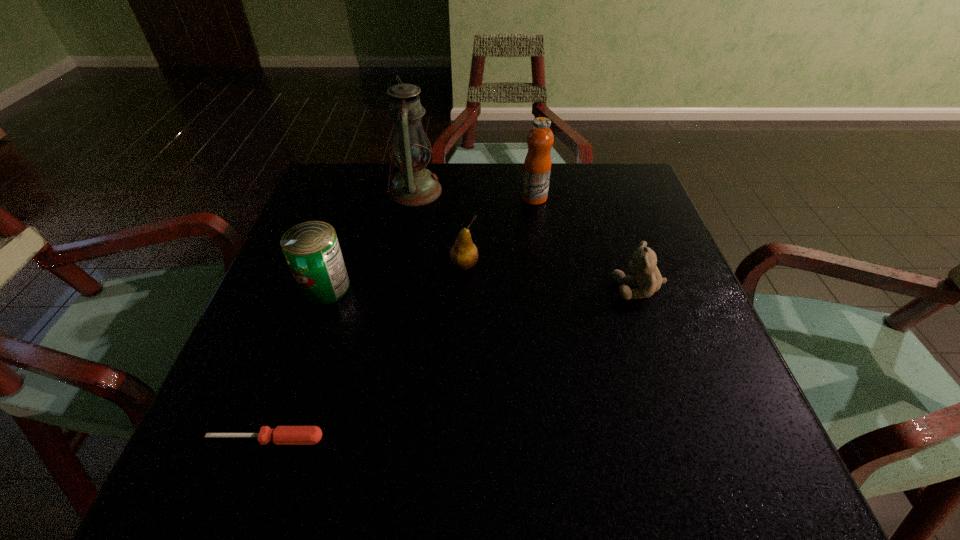
Where is `free space that is in between the fifth tallest object and the fourth object from left to right`? free space that is in between the fifth tallest object and the fourth object from left to right is located at coordinates click(x=551, y=277).

I want to click on free space that is in between the oil lamp and the screwdriver, so click(x=341, y=315).

You are a GUI agent. You are given a task and a screenshot of the screen. Output one action in this format:
    pyautogui.click(x=<x>, y=<y>)
    Task: Click on the object that is the fourth closest to the fifth shortest object
    
    Given the screenshot: What is the action you would take?
    pyautogui.click(x=312, y=251)

Where is `the fourth closest object relative to the can`? This screenshot has height=540, width=960. the fourth closest object relative to the can is located at coordinates (537, 166).

Find the location of a particular element. The image size is (960, 540). vacant space that satisfies the following two spatial constraints: 1. on the back side of the nearest object; 2. on the left side of the tallest object is located at coordinates (354, 191).

In order to click on vacant point that satisfies the following two spatial constraints: 1. on the front side of the fourth object from left to right; 2. on the left side of the oil lamp in this screenshot , I will do `click(402, 266)`.

Locate an element on the screen. free location that satisfies the following two spatial constraints: 1. on the front side of the tallest object; 2. on the left side of the fifth shortest object is located at coordinates (415, 198).